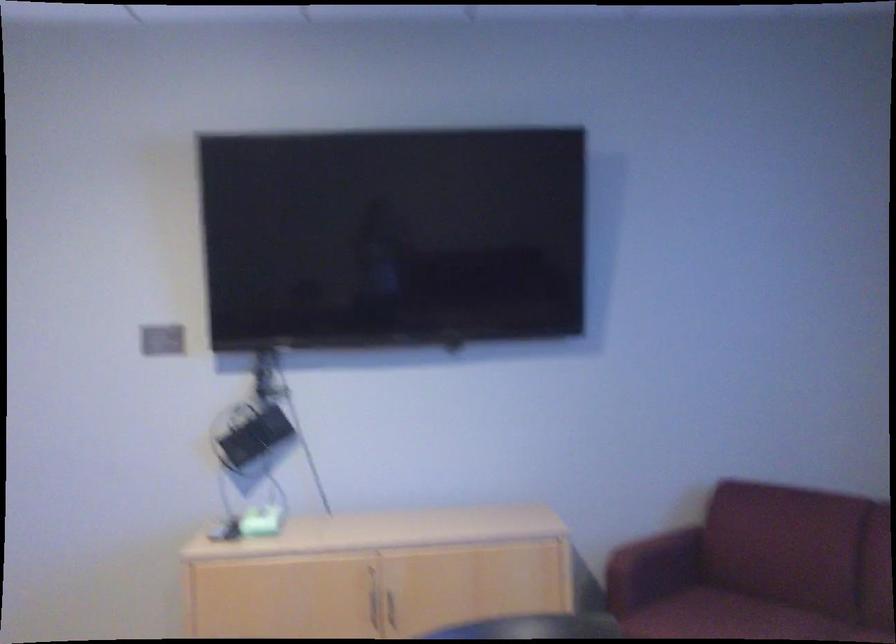
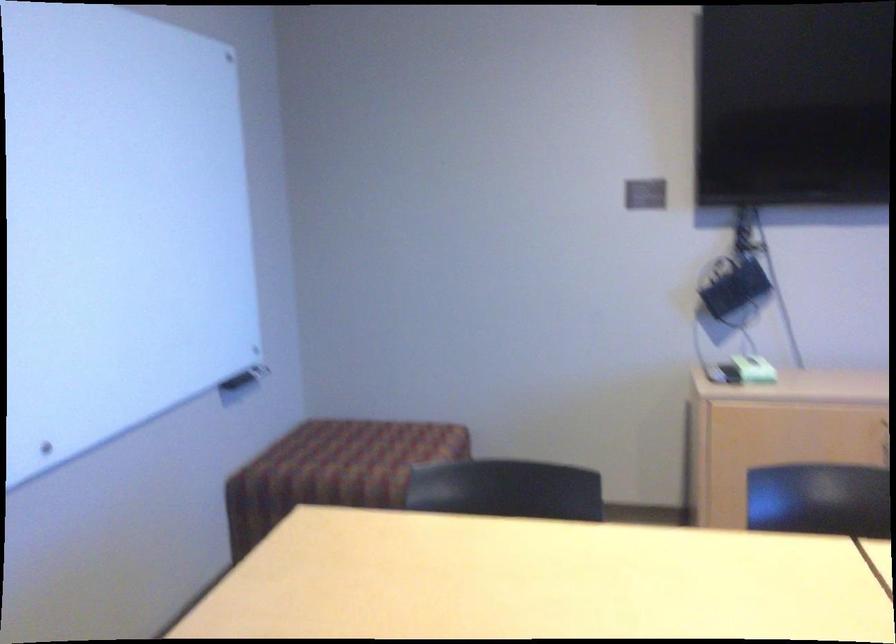
Where in the second image is the point corresponding to (256,436) from the first image?

(734, 289)